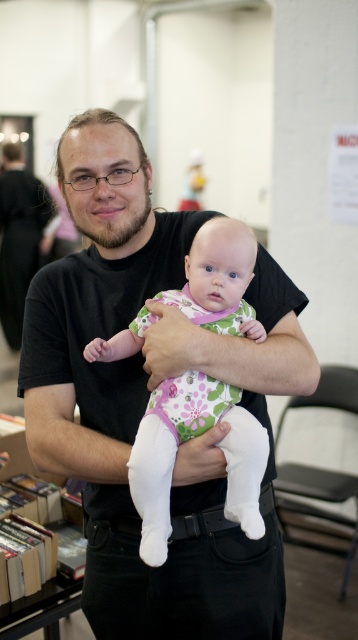
Which is above, black matte shirt at center or floral cotton onesie at center?

floral cotton onesie at center is above.

Does black matte shirt at center have a greater width compared to floral cotton onesie at center?

Indeed, black matte shirt at center has a greater width compared to floral cotton onesie at center.

What do you see at coordinates (147, 397) in the screenshot? I see `black matte shirt at center` at bounding box center [147, 397].

The width and height of the screenshot is (358, 640). Find the location of `black matte shirt at center`. black matte shirt at center is located at coordinates (147, 397).

Consider the image. Between floral cotton onesie at center and hardcover books at left, which one appears on the left side from the viewer's perspective?

From the viewer's perspective, hardcover books at left appears more on the left side.

From the picture: Can you confirm if floral cotton onesie at center is positioned below hardcover books at left?

Incorrect, floral cotton onesie at center is not positioned below hardcover books at left.

Is point (264, 442) positioned before point (23, 428)?

That is True.

Locate an element on the screen. The width and height of the screenshot is (358, 640). floral cotton onesie at center is located at coordinates (189, 438).

Who is positioned more to the left, black matte shirt at center or hardcover books at left?

Positioned to the left is hardcover books at left.

Between point (126, 472) and point (50, 532), which one is positioned behind?

Positioned behind is point (50, 532).

Who is more forward, [81,125] or [71,589]?

Point [81,125]

Where is `black matte shirt at center`? The height and width of the screenshot is (640, 358). black matte shirt at center is located at coordinates (147, 397).